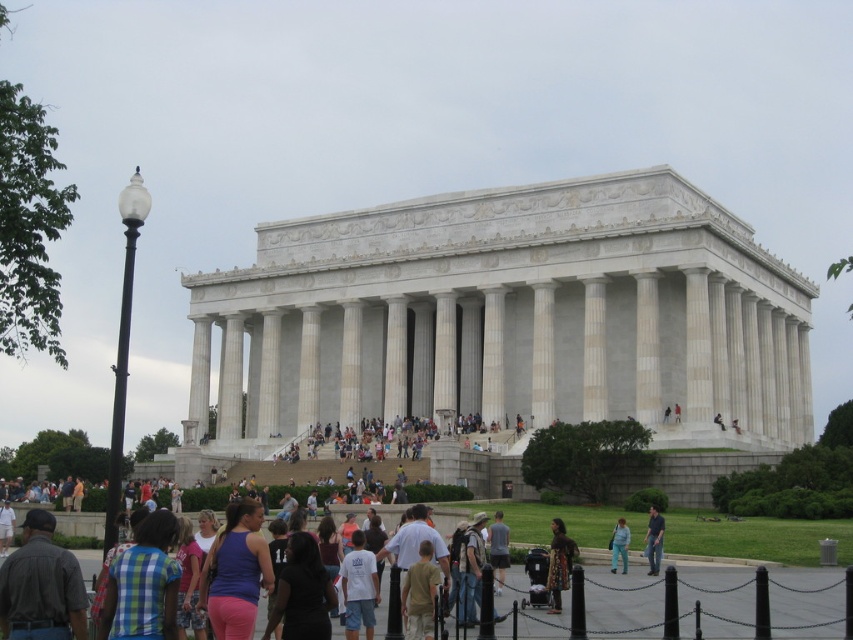
Which is in front, point (30, 612) or point (552, 609)?

Positioned in front is point (30, 612).

Which is more to the left, dark gray shirt at lower left or patterned fabric dress at center?

From the viewer's perspective, dark gray shirt at lower left appears more on the left side.

Which is behind, point (0, 568) or point (567, 573)?

Positioned behind is point (567, 573).

Identify the location of dark gray shirt at lower left. (41, 586).

Is purple matte tank top at center wider than denim pants at lower center?

Correct, the width of purple matte tank top at center exceeds that of denim pants at lower center.

Looking at this image, can you confirm if purple matte tank top at center is positioned above denim pants at lower center?

Yes.

What are the coordinates of `purple matte tank top at center` in the screenshot? It's located at (236, 572).

Does purple matte tank top at center have a greater height compared to patterned fabric dress at center?

Yes.

Does purple matte tank top at center appear over patterned fabric dress at center?

Yes, purple matte tank top at center is above patterned fabric dress at center.

Find the location of a particular element. This screenshot has height=640, width=853. purple matte tank top at center is located at coordinates (236, 572).

I want to click on purple matte tank top at center, so click(236, 572).